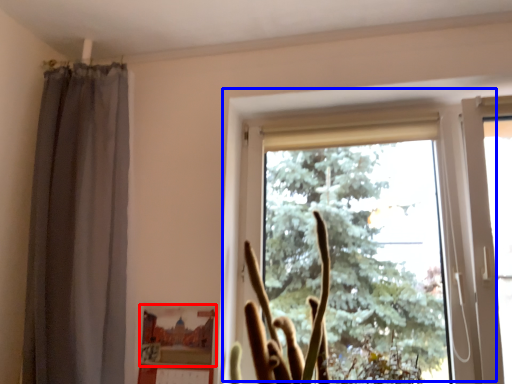
Question: Which object is further to the camera taking this photo, picture frame (highlighted by a red box) or window (highlighted by a blue box)?

Choices:
 (A) picture frame
 (B) window

Answer: (A)